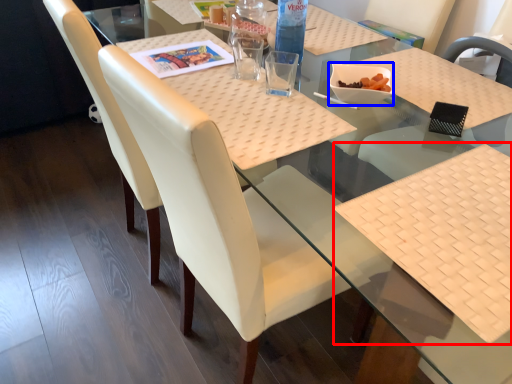
Question: Which object is further to the camera taking this photo, place mat (highlighted by a red box) or food (highlighted by a blue box)?

Choices:
 (A) place mat
 (B) food

Answer: (B)